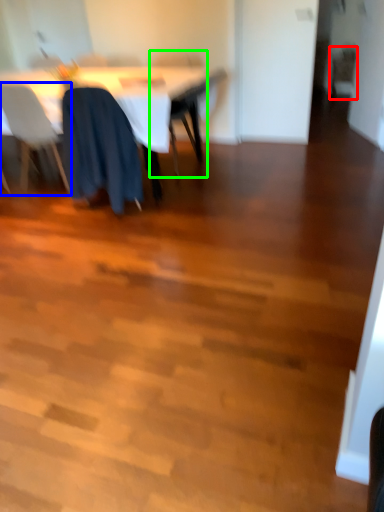
Question: Based on their relative distances, which object is nearer to chair (highlighted by a red box)? Choose from chair (highlighted by a blue box) and chair (highlighted by a green box).

Choices:
 (A) chair
 (B) chair

Answer: (B)